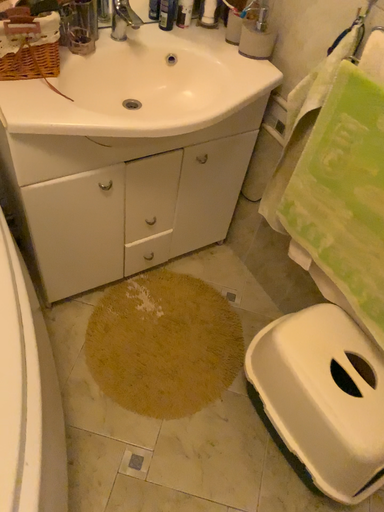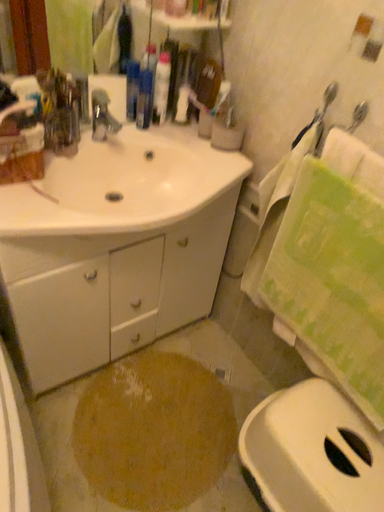
Question: How did the camera likely rotate when shooting the video?

Choices:
 (A) rotated upward
 (B) rotated downward

Answer: (A)